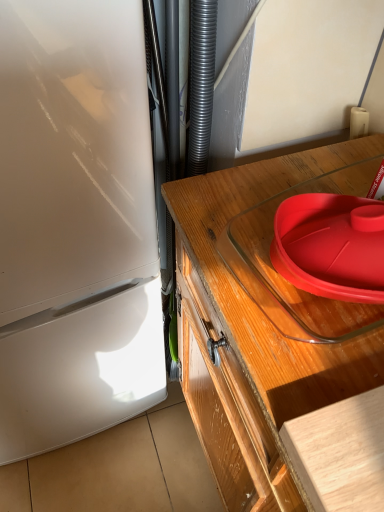
This screenshot has width=384, height=512. I want to click on free spot behind red plastic lid at upper right, so click(325, 174).